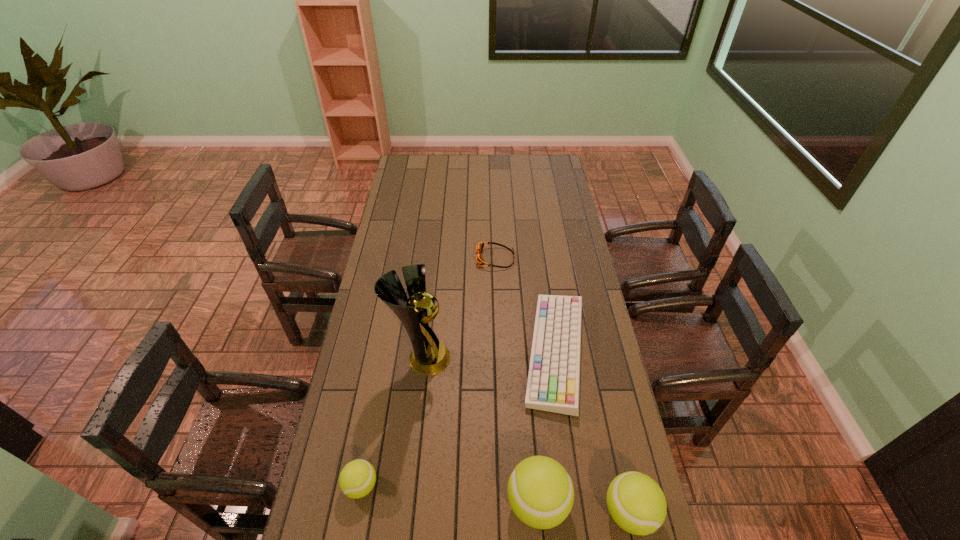
Locate an element on the screen. Image resolution: width=960 pixels, height=540 pixels. the third shortest object is located at coordinates (357, 479).

At what (x,y) coordinates should I click in order to perform the action: click on the leftmost tennis ball. Please return your answer as a coordinate pair (x, y). The height and width of the screenshot is (540, 960). Looking at the image, I should click on (357, 479).

I want to click on the second tennis ball from left to right, so click(x=540, y=491).

Where is `award`? award is located at coordinates (429, 356).

Where is `computer keyboard`? The width and height of the screenshot is (960, 540). computer keyboard is located at coordinates (553, 384).

Image resolution: width=960 pixels, height=540 pixels. What are the coordinates of `the farthest object` in the screenshot? It's located at (479, 247).

At what (x,y) coordinates should I click in order to perform the action: click on goggles. Please return your answer as a coordinate pair (x, y). The width and height of the screenshot is (960, 540). Looking at the image, I should click on (479, 247).

Identify the location of free region located 0.370m on the right of the shortest tennis ball. (508, 485).

This screenshot has width=960, height=540. Find the location of `free space located 0.340m on the left of the second tennis ball from left to right`. free space located 0.340m on the left of the second tennis ball from left to right is located at coordinates (384, 503).

At what (x,y) coordinates should I click in order to perform the action: click on free region located 0.300m at the front of the tallest object, where the globe is visible. Please return your answer as a coordinate pair (x, y). Image resolution: width=960 pixels, height=540 pixels. Looking at the image, I should click on (535, 358).